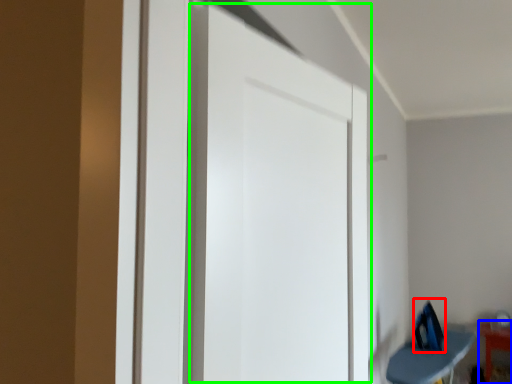
Question: Considering the real-world distances, which object is closest to swivel chair (highlighted by a red box)? furniture (highlighted by a blue box) or door (highlighted by a green box).

Choices:
 (A) furniture
 (B) door

Answer: (A)